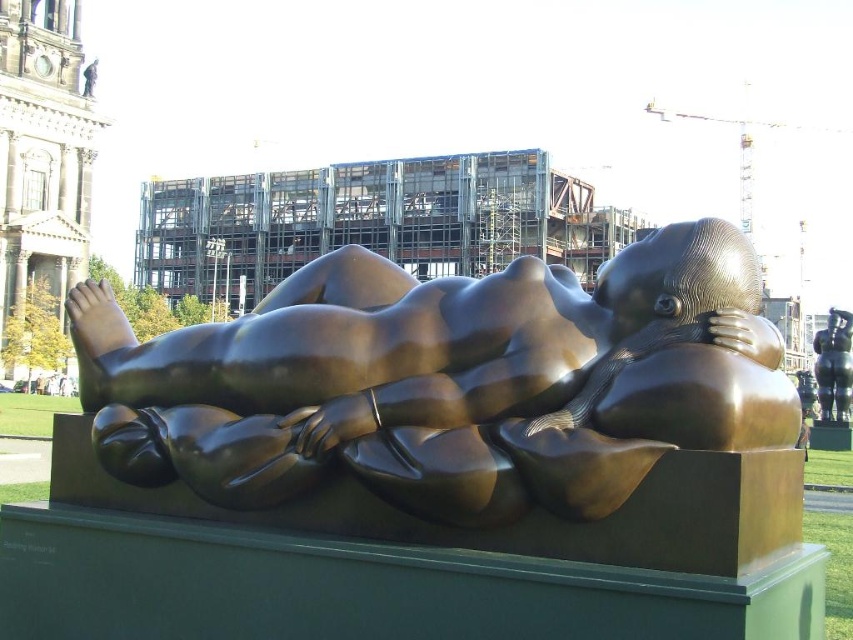
Does bronze sculpture at center have a larger size compared to bronze figure at center?

Indeed, bronze sculpture at center has a larger size compared to bronze figure at center.

Who is shorter, bronze sculpture at center or bronze figure at center?

With less height is bronze sculpture at center.

Who is more forward, (123, 406) or (827, 337)?

Positioned in front is point (123, 406).

You are a GUI agent. You are given a task and a screenshot of the screen. Output one action in this format:
    pyautogui.click(x=<x>, y=<y>)
    Task: Click on the bronze sculpture at center
    
    Given the screenshot: What is the action you would take?
    pyautogui.click(x=447, y=381)